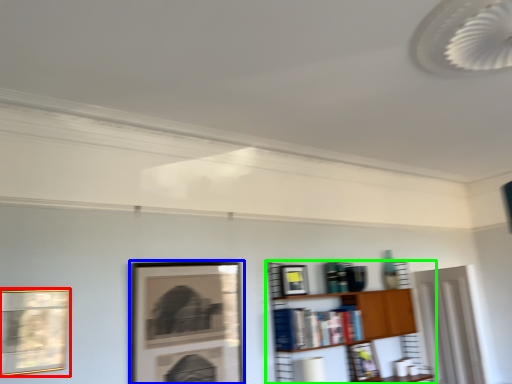
Question: Which object is the farthest from picture frame (highlighted by a red box)? Choose among these: picture frame (highlighted by a blue box) or shelf (highlighted by a green box).

Choices:
 (A) picture frame
 (B) shelf

Answer: (B)